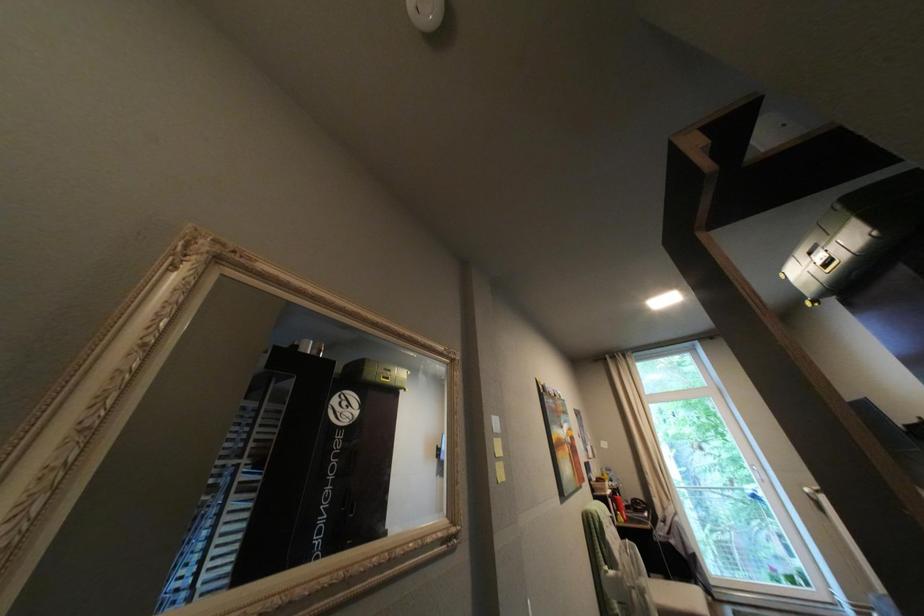
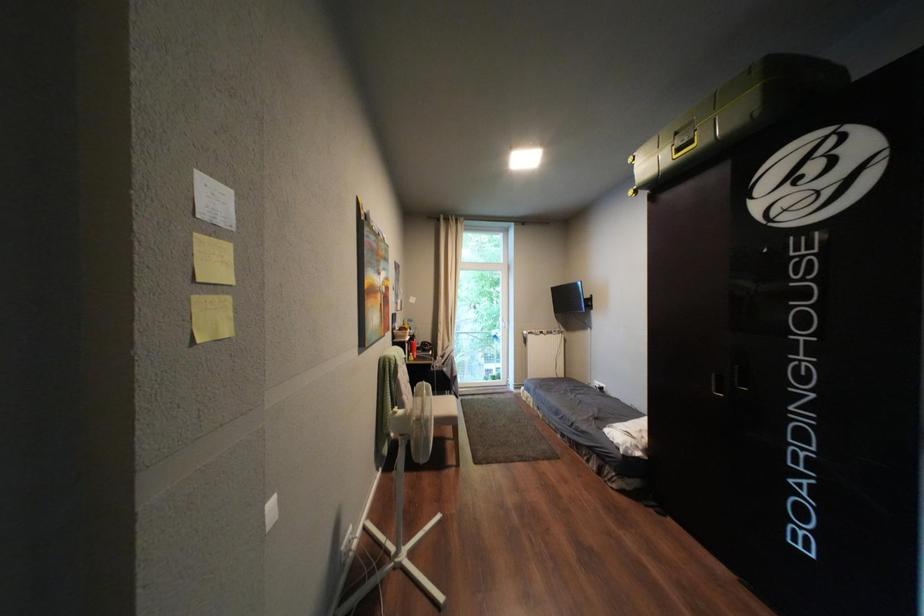
How did the camera likely rotate?

The camera's rotation is toward right-down.